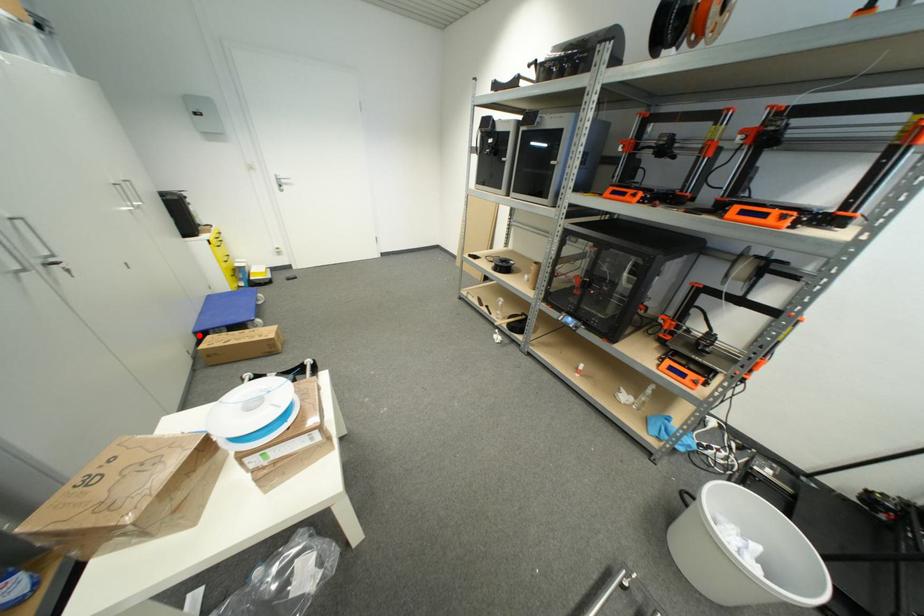
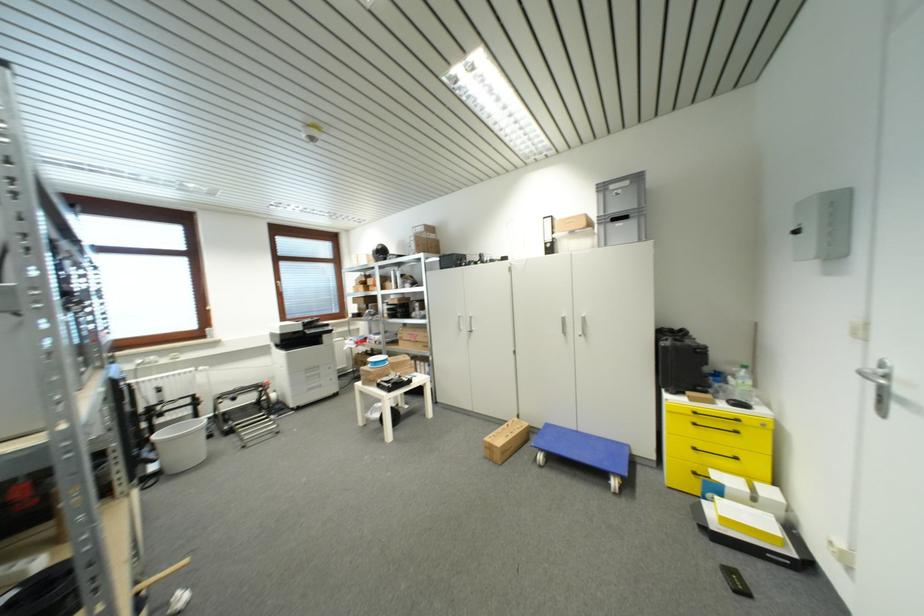
Locate, in the second image, the point that corresponds to the highlighted location in the first image.

(552, 427)